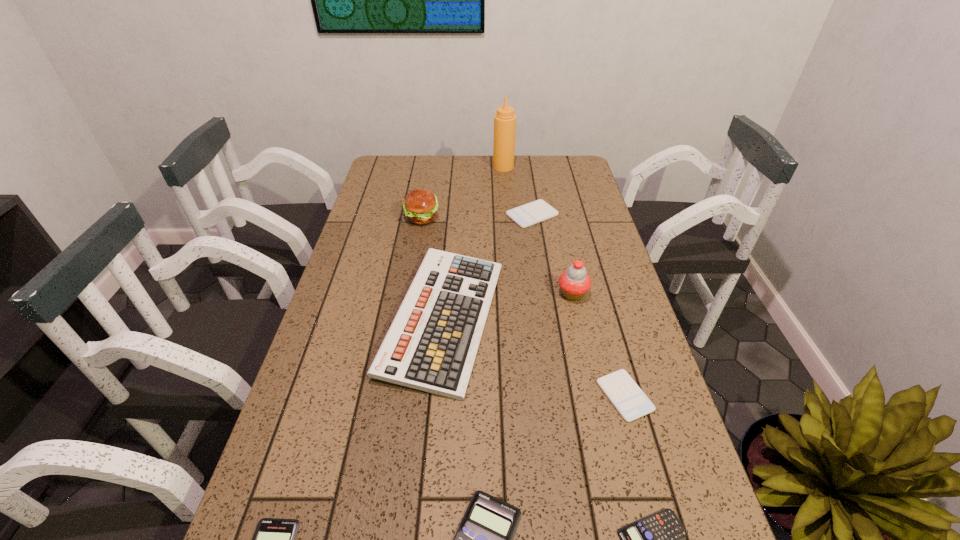
Find the location of a particular element. free space at the far edge is located at coordinates (478, 178).

In the image, there is a desktop. At what (x,y) coordinates should I click in order to perform the action: click on free space at the left edge. Please return your answer as a coordinate pair (x, y). Image resolution: width=960 pixels, height=540 pixels. Looking at the image, I should click on (324, 479).

In the image, there is a desktop. Where is `free space at the right edge`? free space at the right edge is located at coordinates coord(569,247).

The width and height of the screenshot is (960, 540). What are the coordinates of `vacant space that's between the red cupcake and the farther white calculator` in the screenshot? It's located at (552, 254).

Find the location of a particular element. unoccupied area between the computer keyboard and the second farthest calculator is located at coordinates (535, 357).

You are a GUI agent. You are given a task and a screenshot of the screen. Output one action in this format:
    pyautogui.click(x=<x>, y=<y>)
    Task: Click on the blank region between the condiment and the sixth shortest object
    This screenshot has height=540, width=960.
    Given the screenshot: What is the action you would take?
    pyautogui.click(x=473, y=242)

This screenshot has width=960, height=540. Find the location of `vacant area that lies between the second farthest calculator and the fourth tallest object`. vacant area that lies between the second farthest calculator and the fourth tallest object is located at coordinates (535, 357).

Image resolution: width=960 pixels, height=540 pixels. I want to click on object that is the fourth nearest to the second blue calculator from left to right, so click(x=274, y=539).

This screenshot has width=960, height=540. I want to click on the sixth closest object to the bigger white calculator, so (x=484, y=539).

Where is `calculator object that ranks as the second closest to the nearer white calculator`? Image resolution: width=960 pixels, height=540 pixels. calculator object that ranks as the second closest to the nearer white calculator is located at coordinates (484, 539).